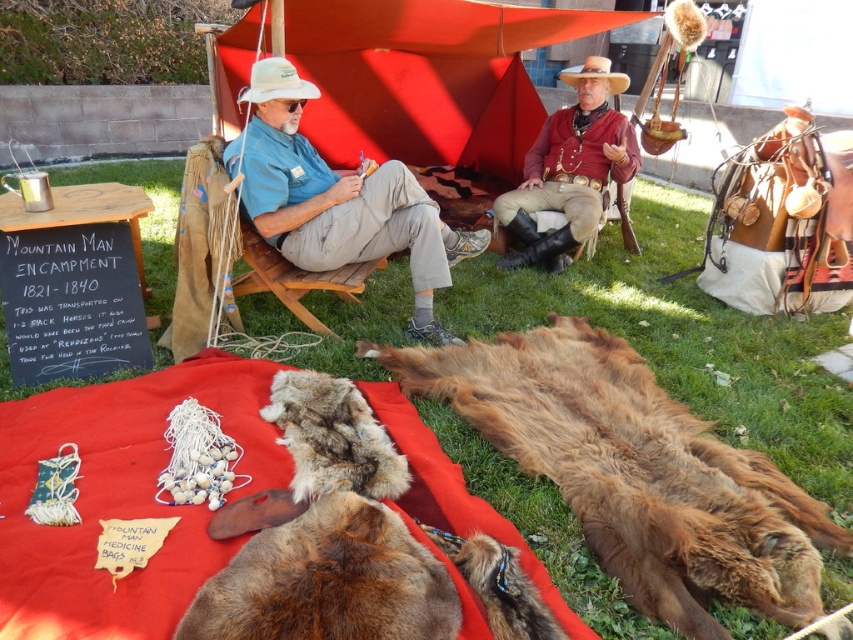
Between point (345, 214) and point (607, 83), which one is positioned in front?

Point (345, 214) is in front.

Who is lower down, matte blue shirt at upper left or brown straw cowboy hat at upper center?

matte blue shirt at upper left is below.

Which is in front, point (323, 262) or point (624, 74)?

Point (323, 262) is in front.

Identify the location of matte blue shirt at upper left. The height and width of the screenshot is (640, 853). (338, 198).

Can you confirm if wooden chair at center is positioned below brown straw cowboy hat at upper center?

Correct, wooden chair at center is located below brown straw cowboy hat at upper center.

Describe the element at coordinates (294, 276) in the screenshot. I see `wooden chair at center` at that location.

The width and height of the screenshot is (853, 640). What do you see at coordinates (294, 276) in the screenshot? I see `wooden chair at center` at bounding box center [294, 276].

Where is `wooden chair at center`? wooden chair at center is located at coordinates (294, 276).

Who is higher up, rustic leather cowboy hat at upper center or white felt cowboy hat at upper center?

white felt cowboy hat at upper center is above.

What do you see at coordinates (570, 170) in the screenshot?
I see `rustic leather cowboy hat at upper center` at bounding box center [570, 170].

Does point (607, 170) lie behind point (263, 84)?

Yes, point (607, 170) is behind point (263, 84).

The image size is (853, 640). Find the location of `rustic leather cowboy hat at upper center`. rustic leather cowboy hat at upper center is located at coordinates (570, 170).